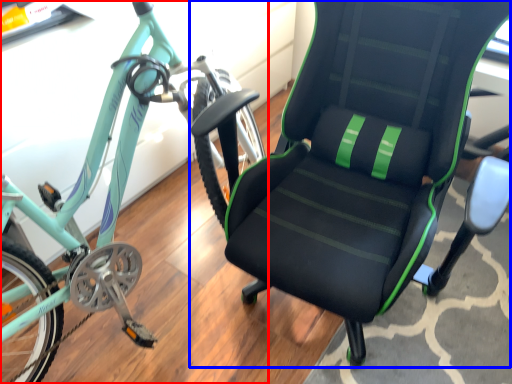
Question: Which object is closer to the camera taking this photo, bicycle (highlighted by a red box) or chair (highlighted by a blue box)?

Choices:
 (A) bicycle
 (B) chair

Answer: (A)